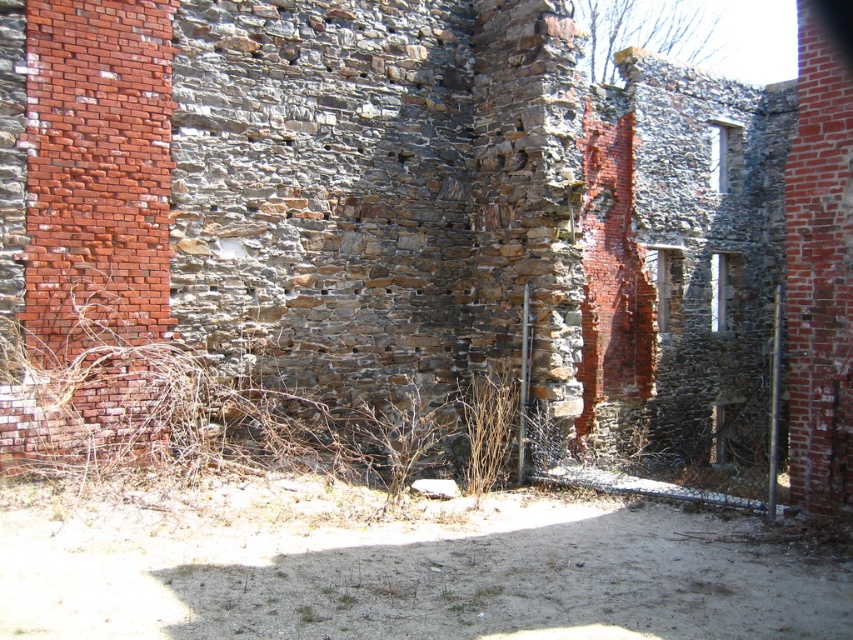
Between point (390, 454) and point (479, 420), which one is positioned behind?

The point (390, 454) is more distant.

From the picture: Can you confirm if brown dry weed at center is smaller than brown dry grass at center?

No, brown dry weed at center is not smaller than brown dry grass at center.

What are the coordinates of `brown dry weed at center` in the screenshot? It's located at (399, 436).

You are a GUI agent. You are given a task and a screenshot of the screen. Output one action in this format:
    pyautogui.click(x=<x>, y=<y>)
    Task: Click on the brown dry weed at center
    
    Given the screenshot: What is the action you would take?
    tap(399, 436)